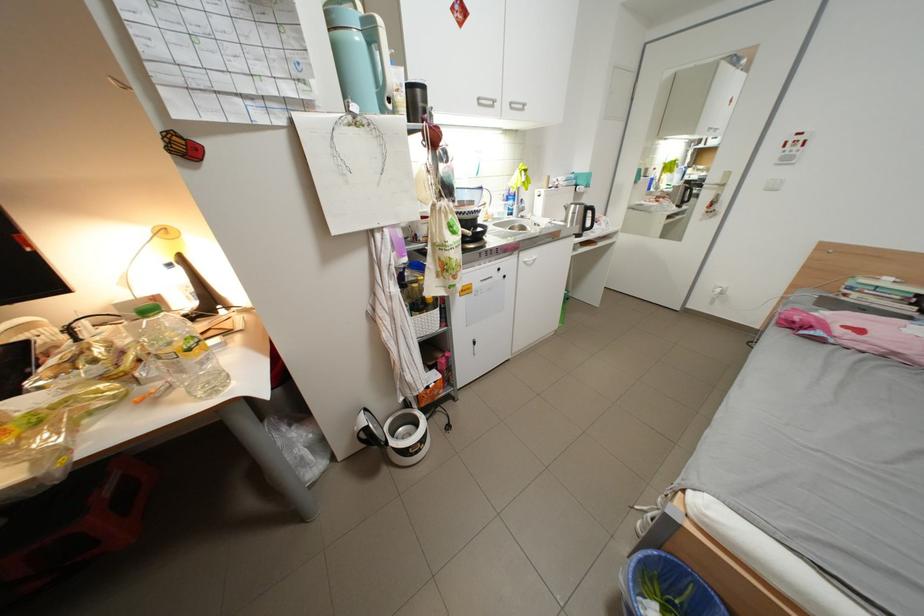
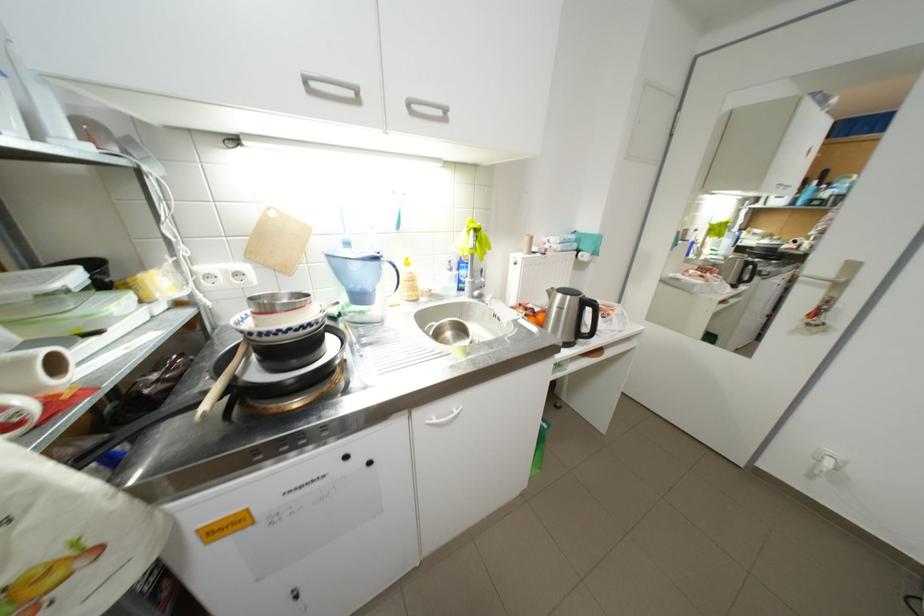
In the second image, find the point that corresponds to (x=492, y=188) in the first image.

(387, 259)